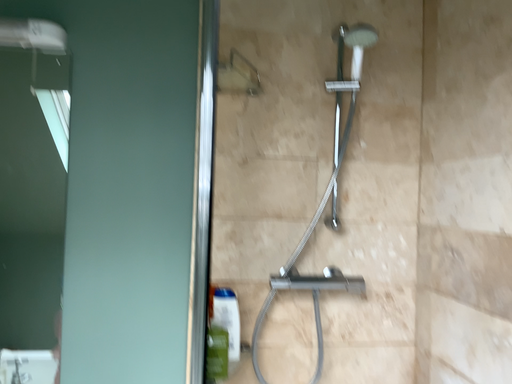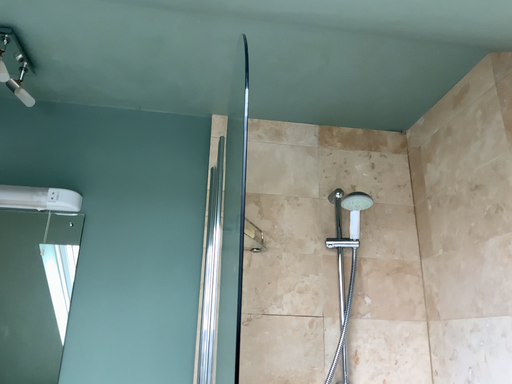
Question: Which way did the camera rotate in the video?

Choices:
 (A) rotated upward
 (B) rotated downward

Answer: (A)